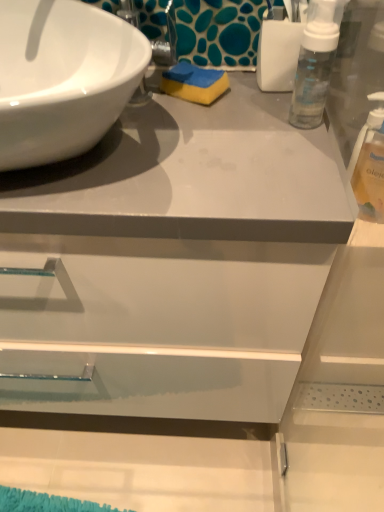
Where is `vacant space to the right of blue/yellow sponge at center`? The image size is (384, 512). vacant space to the right of blue/yellow sponge at center is located at coordinates (271, 111).